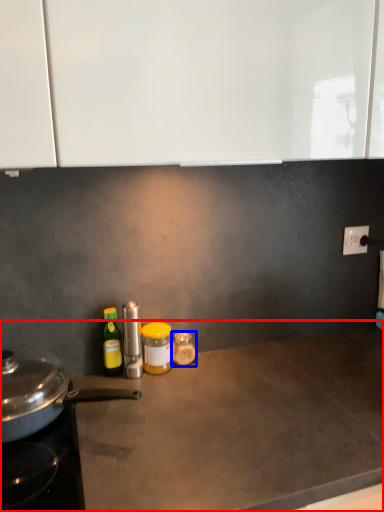
Question: Among these objects, which one is nearest to the camera, countertop (highlighted by a red box) or bottle (highlighted by a blue box)?

Choices:
 (A) countertop
 (B) bottle

Answer: (A)